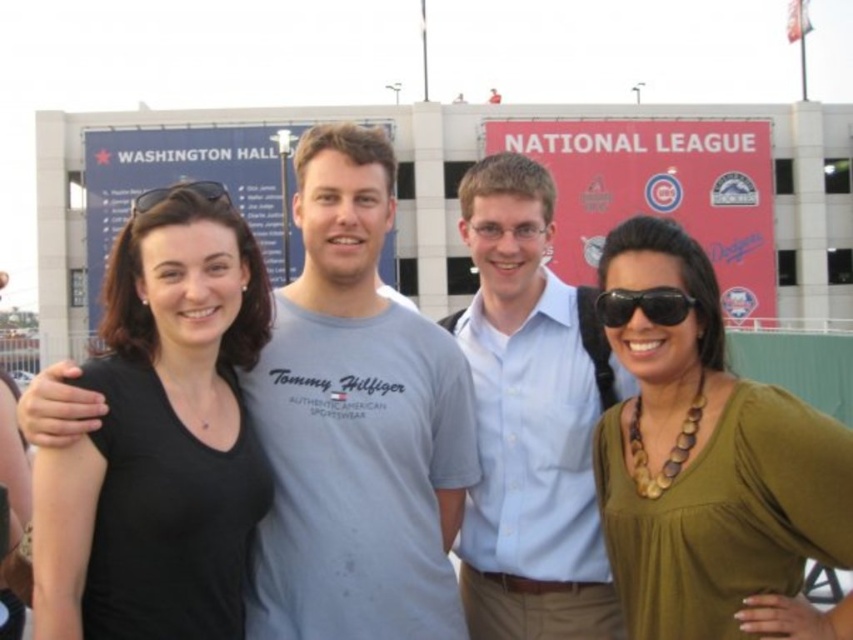
Looking at this image, you are a photographer trying to adjust the framing of the photo so that both the black matte shirt at center and the light blue shirt at center are clearly visible. Which shirt should you focus on first to ensure the taller person is in frame?

The light blue shirt at center is taller than the black matte shirt at center, so you should focus on the light blue shirt at center first to ensure the taller person is in frame.

You are standing in front of the stadium backdrop and want to place a small sticker at each of the two points mentioned. Which point is closer to you, point (631, 230) or point (181, 196)?

Point (181, 196) is closer to you because it is less further to the viewer than point (631, 230).